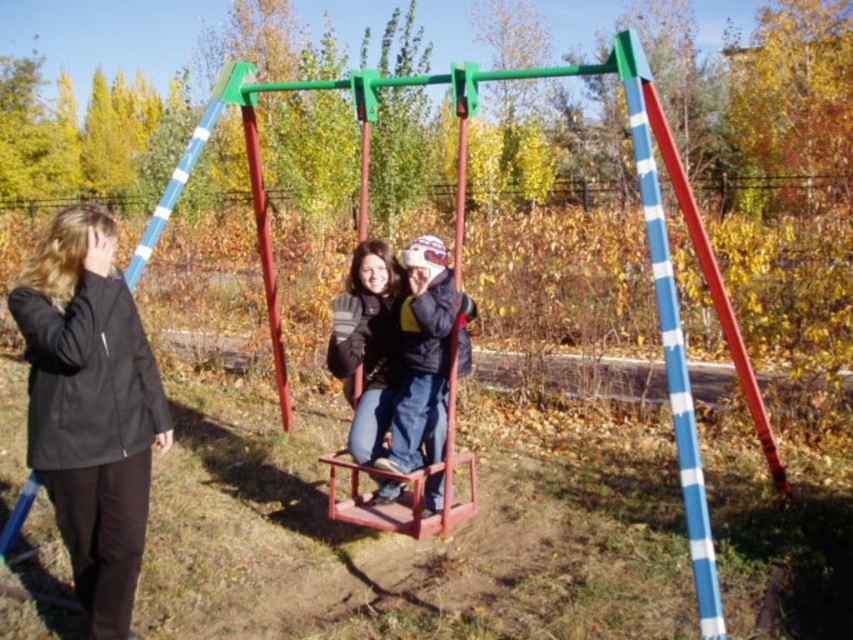
You are a parent standing at the playground and want to ensure safety between your child and another adult. The black matte jacket at left and velvet blue jacket at center are both present. Can a 1.5 meter distance be maintained between them?

The distance between the black matte jacket at left and velvet blue jacket at center is 1.59 meters, which is slightly more than 1.5 meters. Therefore, the required distance is maintained.

You are standing in the playground and want to place a small decorative rock at the point closer to you between the two points marked as point (102,280) and point (430,257). Which point should you choose?

You should choose point (102,280) because it is closer to the viewer than point (430,257).

You are standing in the playground and want to walk from point A to point B. Point A is located at coordinate point (135, 490) and point B is at coordinate point (709, 605). Which point is closer to you when you start walking?

Point A at coordinate point (135, 490) is closer to you than point B at coordinate point (709, 605) because it is further to the viewer.